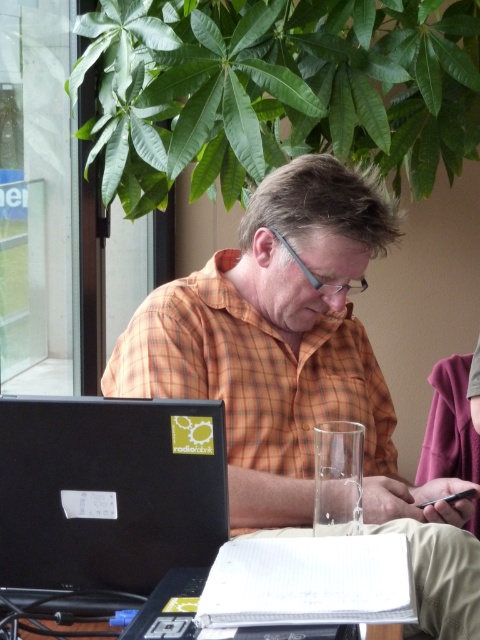
The man is sitting at a desk with a laptop and a glass. Where is the white textured notebook at center located relative to the man?

The white textured notebook at center is located at the center of the desk, directly in front of the man.

You are organizing a desk and need to place the white textured notebook at center and the white paper at lower center into a drawer. Which item should you place first to ensure they both fit vertically?

You should place the white paper at lower center first because the white textured notebook at center is thinner than it, allowing the thicker paper to be placed first to accommodate both items vertically.

The man is wearing an orange checkered shirt at center and has a black matte laptop at lower left. Based on their positions, which item is closer to the top of the image?

The orange checkered shirt at center is above the black matte laptop at lower left, so the orange checkered shirt at center is closer to the top of the image.